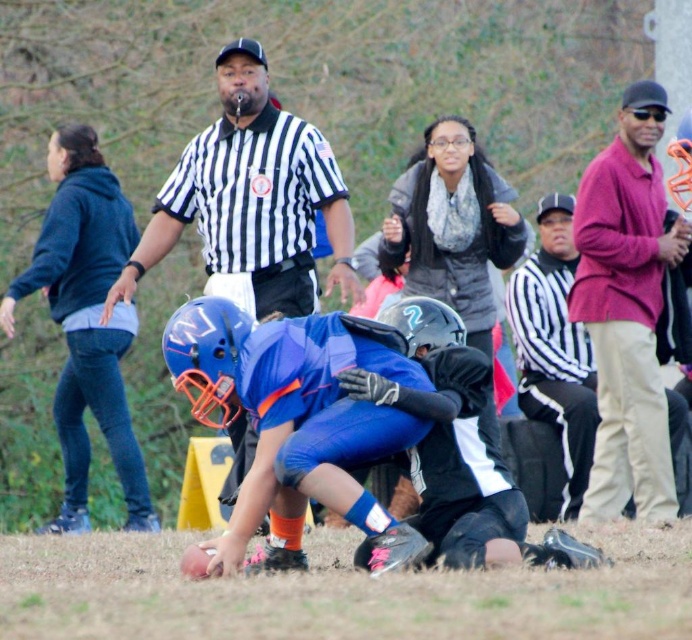
Question: Is black striped shirt at center bigger than matte pink shirt at right?

Choices:
 (A) yes
 (B) no

Answer: (A)

Question: Which point appears closest to the camera in this image?

Choices:
 (A) (226, 240)
 (B) (641, 248)

Answer: (A)

Question: Which point is farther from the camera taking this photo?

Choices:
 (A) (260, 200)
 (B) (621, 369)

Answer: (B)

Question: Considering the relative positions of black striped shirt at center and matte pink shirt at right in the image provided, where is black striped shirt at center located with respect to matte pink shirt at right?

Choices:
 (A) below
 (B) above

Answer: (B)

Question: Is black striped shirt at center positioned behind matte pink shirt at right?

Choices:
 (A) yes
 (B) no

Answer: (B)

Question: Which point appears farthest from the camera in this image?

Choices:
 (A) (650, 380)
 (B) (291, 214)

Answer: (A)